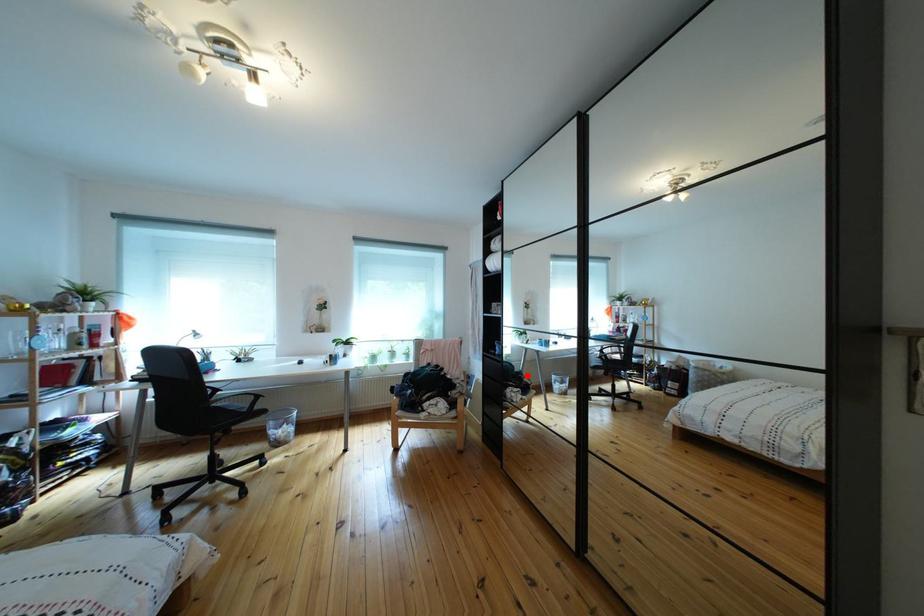
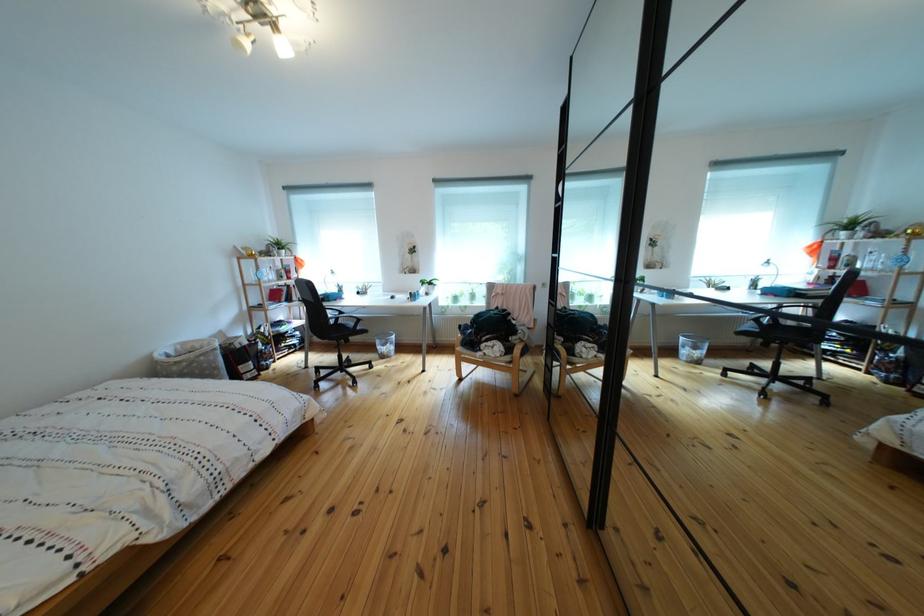
Locate, in the second image, the point that corresponds to the highlighted location in the first image.

(613, 329)